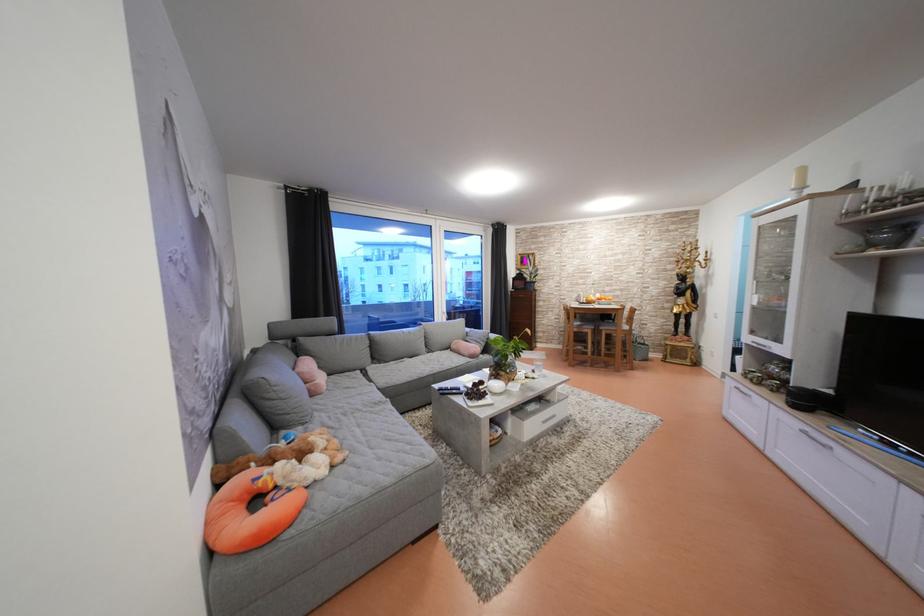
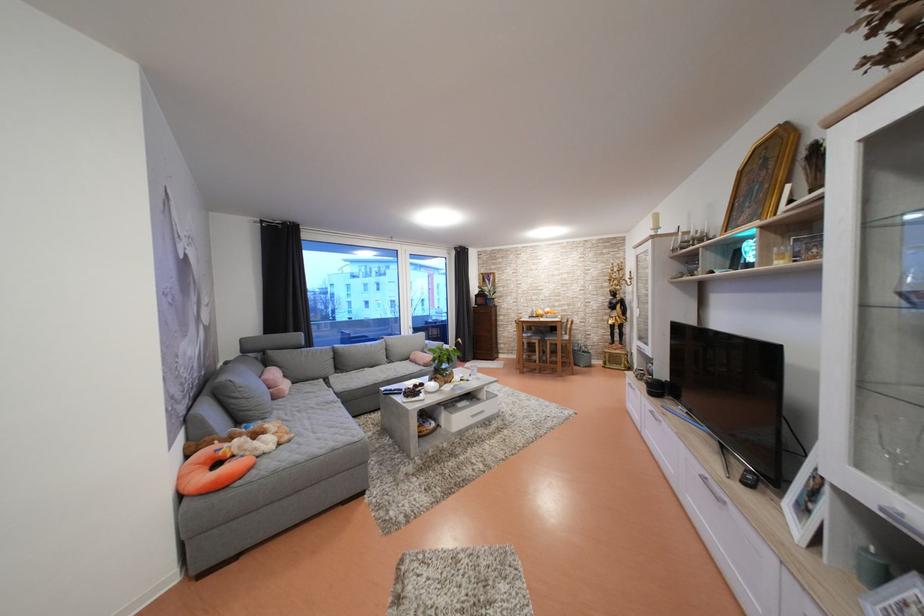
Locate, in the second image, the point that corresponds to (479,362) in the first image.

(432, 370)